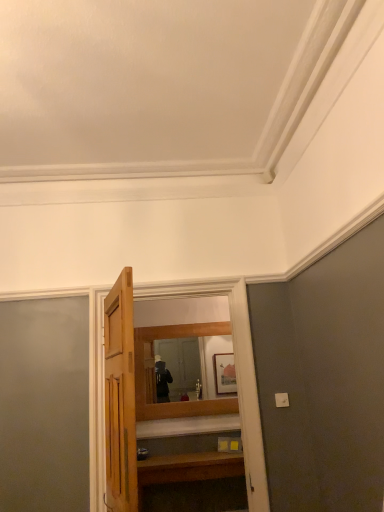
Question: From the image's perspective, is wooden door at center located above or below wooden vanity at lower center?

Choices:
 (A) below
 (B) above

Answer: (B)

Question: Is wooden door at center inside the boundaries of wooden vanity at lower center, or outside?

Choices:
 (A) outside
 (B) inside

Answer: (A)

Question: Estimate the real-world distances between objects in this image. Which object is closer to the wooden door at center?

Choices:
 (A) wooden mirror at center
 (B) wooden vanity at lower center

Answer: (B)

Question: Which is farther from the wooden mirror at center?

Choices:
 (A) wooden vanity at lower center
 (B) wooden door at center

Answer: (B)